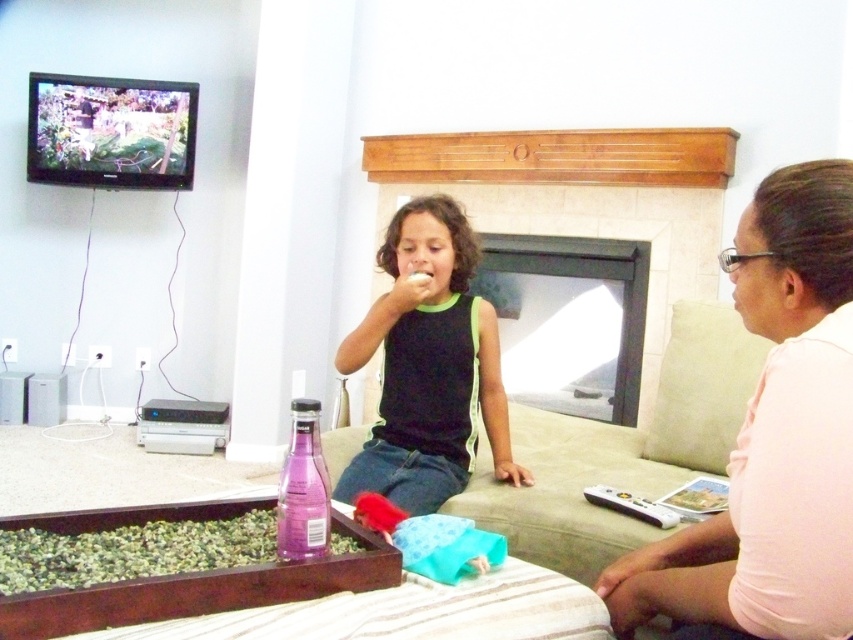
Question: Which of these objects is positioned closest to the green matte plant at lower left?

Choices:
 (A) black matte tank top at center
 (B) pink fabric shirt at right

Answer: (B)

Question: Is pink fabric shirt at right positioned in front of white matte food at center?

Choices:
 (A) no
 (B) yes

Answer: (B)

Question: Which of the following is the farthest from the observer?

Choices:
 (A) (444, 150)
 (B) (309, 448)

Answer: (A)

Question: Is pink fabric shirt at right positioned in front of white matte food at center?

Choices:
 (A) no
 (B) yes

Answer: (B)

Question: In this image, where is pink fabric shirt at right located relative to teal fabric toy at center?

Choices:
 (A) right
 (B) left

Answer: (A)

Question: Among these points, which one is nearest to the camera?

Choices:
 (A) (407, 568)
 (B) (421, 282)
 (C) (412, 356)
 (D) (677, 141)

Answer: (A)